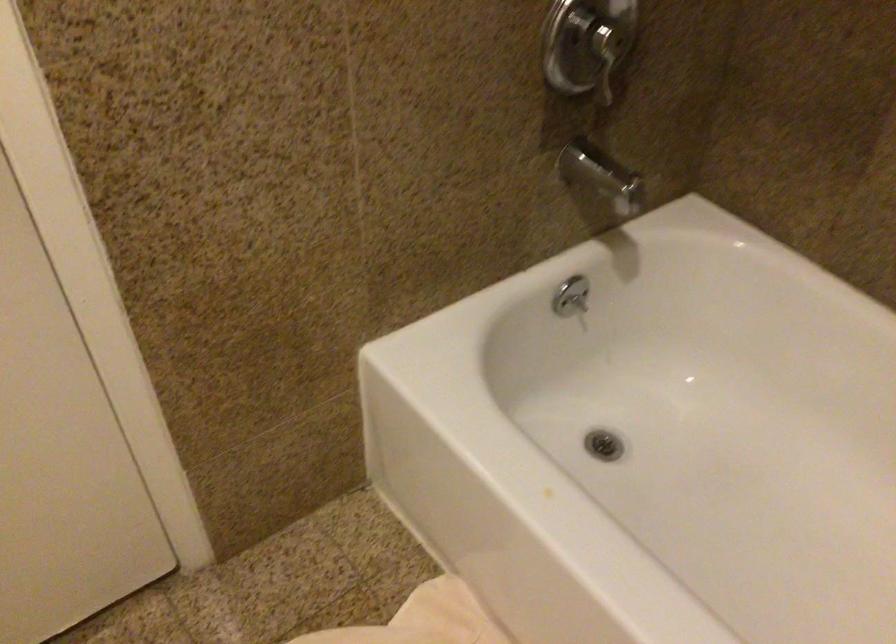
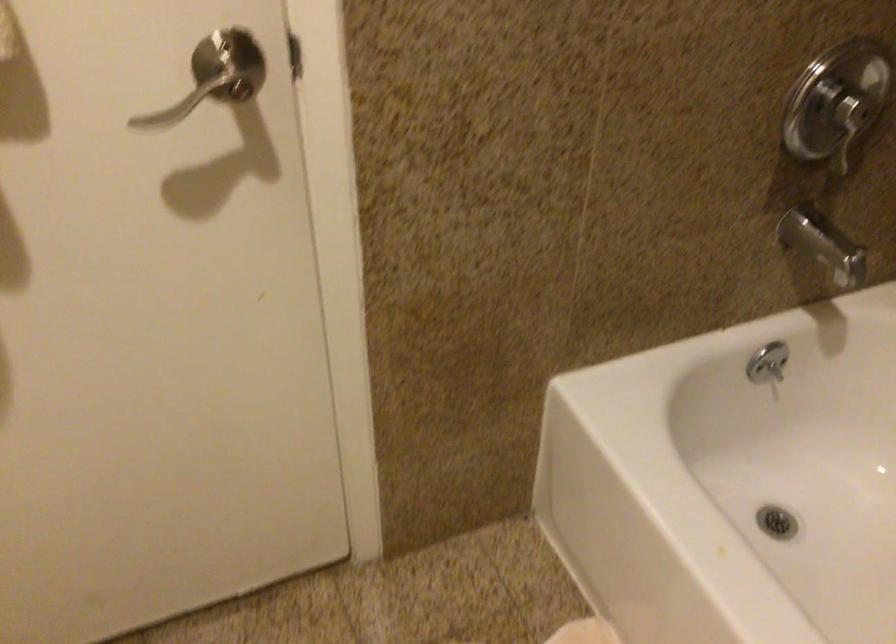
In the second image, find the point that corresponds to (600,449) in the first image.

(776, 522)